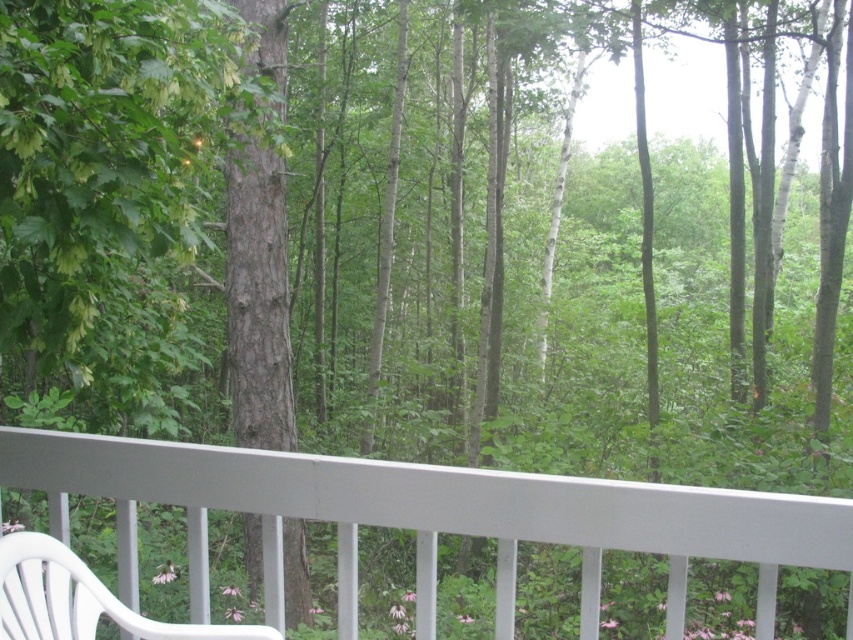
Question: Which is nearer to the white plastic chair at lower left?

Choices:
 (A) brown rough bark tree at center
 (B) white plastic rocking chair at lower left

Answer: (B)

Question: Can you confirm if white plastic chair at lower left is positioned to the left of white plastic rocking chair at lower left?

Choices:
 (A) no
 (B) yes

Answer: (A)

Question: Does brown rough bark tree at center have a greater width compared to white plastic rocking chair at lower left?

Choices:
 (A) no
 (B) yes

Answer: (B)

Question: Observing the image, what is the correct spatial positioning of white plastic chair at lower left in reference to white plastic rocking chair at lower left?

Choices:
 (A) right
 (B) left

Answer: (A)

Question: Considering the real-world distances, which object is closest to the brown rough bark tree at center?

Choices:
 (A) white plastic rocking chair at lower left
 (B) white plastic chair at lower left

Answer: (B)

Question: Which point appears farthest from the camera in this image?

Choices:
 (A) (19, 598)
 (B) (352, 618)

Answer: (B)